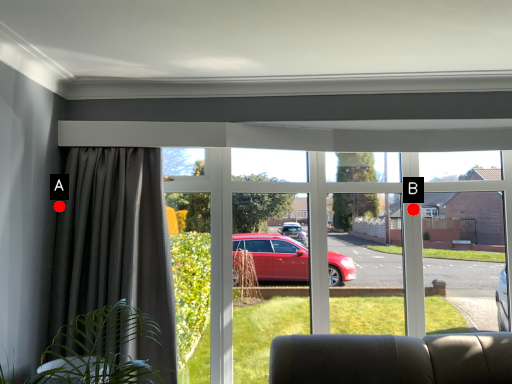
Question: Two points are circled on the image, labeled by A and B beside each circle. Among these points, which one is farthest from the camera?

Choices:
 (A) A is further
 (B) B is further

Answer: (B)